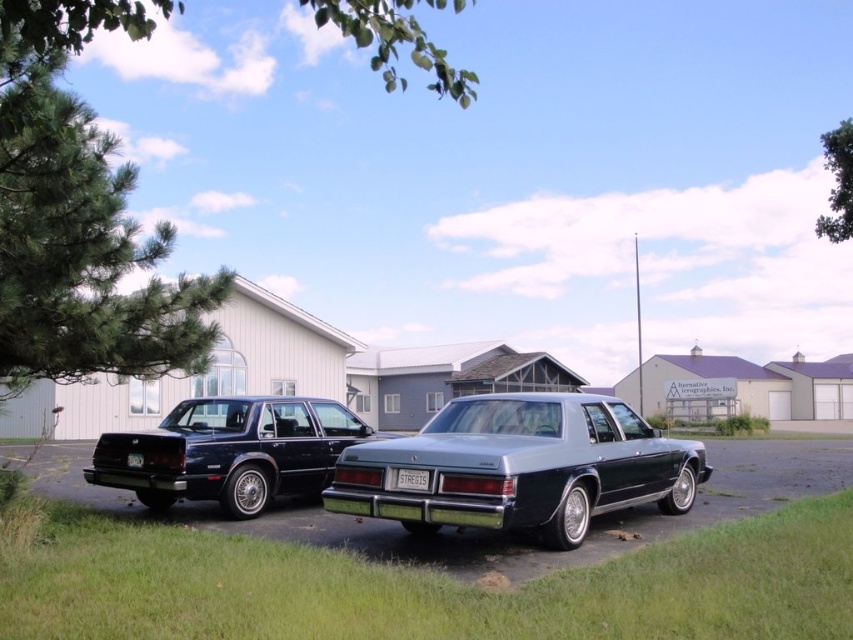
You are a delivery person with a package that needs to be placed between the glossy black sedan at left and the white plastic license plate at center. The package requires 3 meters of space to be placed safely. Do you think there is enough space between them?

The glossy black sedan at left and the white plastic license plate at center are 3.51 meters apart, so yes, there is enough space to place the package safely between them since the distance is greater than the required 3 meters.

You are standing at the point with coordinates point [405,477] and want to see the point [236,518]. Can you see it without moving?

Point [236,518] is behind point [405,477], so you cannot see it without moving.

You are a parking attendant who needs to fit a third car into the space between the satin silver sedan at center and the metallic blue car at center. Based on their heights, can you determine if there is enough vertical clearance between them for the new car?

The satin silver sedan at center is not as tall as metallic blue car at center, so the vertical clearance between them would depend on the height of the taller vehicle, which is the metallic blue car at center. If the new car is shorter than the metallic blue car at center, there might be enough space, but exact dimensions are needed for confirmation.